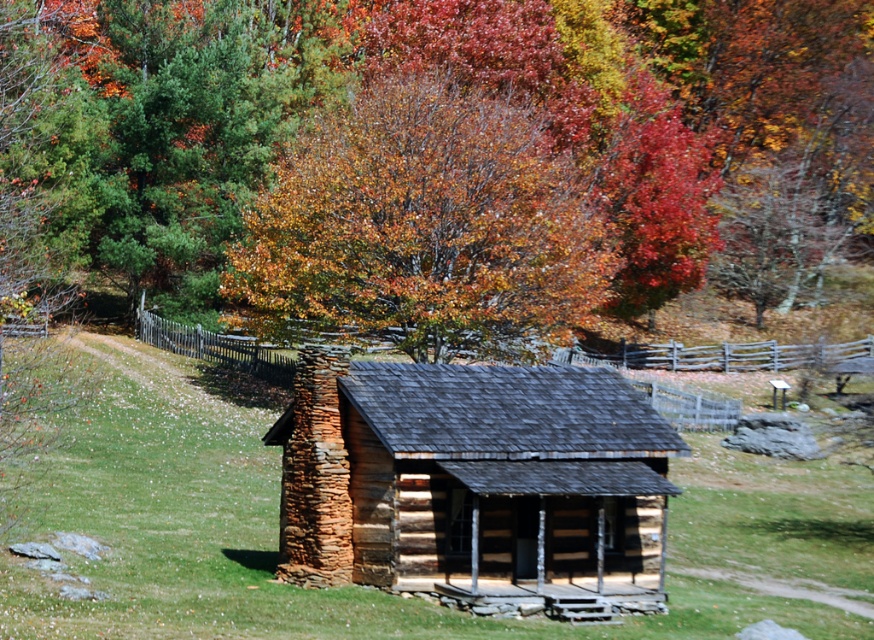
Question: Can you confirm if green grass at center is positioned to the right of autumn leaves at upper center?

Choices:
 (A) no
 (B) yes

Answer: (A)

Question: Does green grass at center have a larger size compared to autumn leaves at upper center?

Choices:
 (A) yes
 (B) no

Answer: (A)

Question: Which point appears closest to the camera in this image?

Choices:
 (A) (850, 595)
 (B) (413, 394)

Answer: (B)

Question: Which is farther from the green grass at center?

Choices:
 (A) wooden log cabin at center
 (B) autumn leaves at upper center

Answer: (B)

Question: Does green grass at center have a greater width compared to wooden log cabin at center?

Choices:
 (A) no
 (B) yes

Answer: (B)

Question: Among these objects, which one is farthest from the camera?

Choices:
 (A) green grass at center
 (B) autumn leaves at upper center
 (C) wooden log cabin at center

Answer: (B)